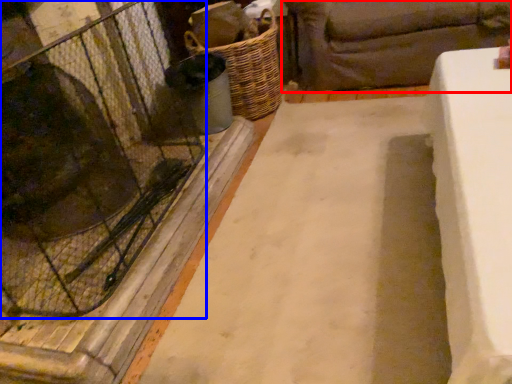
Question: Among these objects, which one is farthest to the camera, studio couch (highlighted by a red box) or glass door (highlighted by a blue box)?

Choices:
 (A) studio couch
 (B) glass door

Answer: (A)